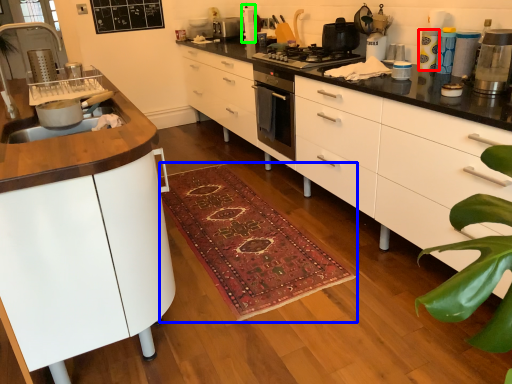
Question: Which is nearer to the appliance (highlighted by a red box)? doormat (highlighted by a blue box) or appliance (highlighted by a green box).

Choices:
 (A) doormat
 (B) appliance

Answer: (A)